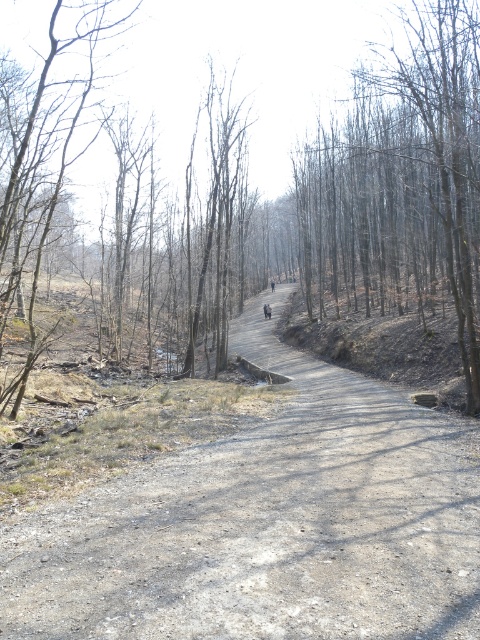
Is dull gray gravel path at center closer to the viewer compared to brown bark tree at center?

Yes.

Who is positioned more to the left, dull gray gravel path at center or brown bark tree at center?

Positioned to the left is brown bark tree at center.

Is point (441, 468) positioned before point (216, 138)?

Yes.

Identify the location of dull gray gravel path at center. Image resolution: width=480 pixels, height=640 pixels. (268, 524).

Can you confirm if brown dirt path at center is positioned below brown bark tree at left?

Actually, brown dirt path at center is above brown bark tree at left.

Is point (369, 134) closer to viewer compared to point (92, 13)?

Yes, point (369, 134) is in front of point (92, 13).

Is point (405, 221) in front of point (55, 42)?

Yes, it is in front of point (55, 42).

Locate an element on the screen. This screenshot has width=480, height=640. brown dirt path at center is located at coordinates (319, 205).

Does dull gray gravel path at center lie in front of brown bark tree at upper center?

Yes.

Does dull gray gravel path at center appear under brown bark tree at upper center?

Yes.

Is point (387, 577) closer to viewer compared to point (474, 353)?

Yes.

Identify the location of dull gray gravel path at center. (268, 524).